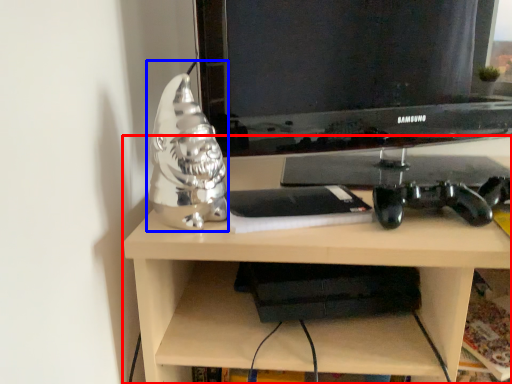
Question: Which object appears closest to the camera in this image, desk (highlighted by a red box) or figurine (highlighted by a blue box)?

Choices:
 (A) desk
 (B) figurine

Answer: (A)